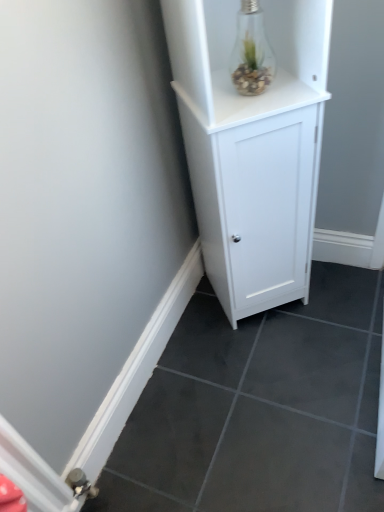
Measure the distance between transparent glass light bulb at upper right and camera.

transparent glass light bulb at upper right and camera are 39.04 inches apart.

What do you see at coordinates (251, 52) in the screenshot? The image size is (384, 512). I see `transparent glass light bulb at upper right` at bounding box center [251, 52].

In order to face transparent glass light bulb at upper right, should I rotate leftwards or rightwards?

To face it directly, rotate right by 8.611 degrees.

I want to click on transparent glass light bulb at upper right, so click(x=251, y=52).

What do you see at coordinates (252, 147) in the screenshot?
I see `white matte cabinet at center` at bounding box center [252, 147].

Locate an element on the screen. The width and height of the screenshot is (384, 512). white matte cabinet at center is located at coordinates (252, 147).

Find the location of a particular element. This screenshot has height=512, width=384. transparent glass light bulb at upper right is located at coordinates (251, 52).

Between white matte cabinet at center and transparent glass light bulb at upper right, which one appears on the right side from the viewer's perspective?

white matte cabinet at center is more to the right.

Considering the relative positions of white matte cabinet at center and transparent glass light bulb at upper right in the image provided, is white matte cabinet at center in front of transparent glass light bulb at upper right?

Yes, white matte cabinet at center is closer to the camera.

Is point (268, 133) positioned before point (259, 6)?

Yes, point (268, 133) is closer to viewer.

From the image's perspective, would you say white matte cabinet at center is positioned over transparent glass light bulb at upper right?

Actually, white matte cabinet at center appears below transparent glass light bulb at upper right in the image.

From a real-world perspective, which is physically above, white matte cabinet at center or transparent glass light bulb at upper right?

In real-world perspective, transparent glass light bulb at upper right is above.

Does white matte cabinet at center have a lesser width compared to transparent glass light bulb at upper right?

No.

Is white matte cabinet at center taller than transparent glass light bulb at upper right?

Correct, white matte cabinet at center is much taller as transparent glass light bulb at upper right.

Who is smaller, white matte cabinet at center or transparent glass light bulb at upper right?

With smaller size is transparent glass light bulb at upper right.

Is transparent glass light bulb at upper right inside white matte cabinet at center?

Indeed, transparent glass light bulb at upper right is located within white matte cabinet at center.

From the picture: Would you consider white matte cabinet at center to be distant from transparent glass light bulb at upper right?

No, there isn't a large distance between white matte cabinet at center and transparent glass light bulb at upper right.

Is transparent glass light bulb at upper right at the back of white matte cabinet at center?

Correct, white matte cabinet at center is looking away from transparent glass light bulb at upper right.

How many degrees apart are the facing directions of white matte cabinet at center and transparent glass light bulb at upper right?

They differ by 0.689 degrees in their facing directions.

You are a GUI agent. You are given a task and a screenshot of the screen. Output one action in this format:
    pyautogui.click(x=<x>, y=<y>)
    Task: Click on the glass vase located behind the white matte cabinet at center
    This screenshot has width=384, height=512.
    Given the screenshot: What is the action you would take?
    pyautogui.click(x=251, y=52)

Based on their positions, is transparent glass light bulb at upper right located to the left or right of white matte cabinet at center?

transparent glass light bulb at upper right is to the left of white matte cabinet at center.

Considering the relative positions of transparent glass light bulb at upper right and white matte cabinet at center in the image provided, is transparent glass light bulb at upper right in front of white matte cabinet at center?

No, the depth of transparent glass light bulb at upper right is greater than that of white matte cabinet at center.

Considering the positions of point (247, 54) and point (225, 289), is point (247, 54) closer or farther from the camera than point (225, 289)?

Point (247, 54).

From the image's perspective, is transparent glass light bulb at upper right under white matte cabinet at center?

Incorrect, from the image's perspective, transparent glass light bulb at upper right is higher than white matte cabinet at center.

From a real-world perspective, who is located higher, transparent glass light bulb at upper right or white matte cabinet at center?

transparent glass light bulb at upper right, from a real-world perspective.

Is transparent glass light bulb at upper right wider than white matte cabinet at center?

No, transparent glass light bulb at upper right is not wider than white matte cabinet at center.

Considering the sizes of objects transparent glass light bulb at upper right and white matte cabinet at center in the image provided, who is shorter, transparent glass light bulb at upper right or white matte cabinet at center?

transparent glass light bulb at upper right.

In the scene shown: Who is smaller, transparent glass light bulb at upper right or white matte cabinet at center?

Smaller between the two is transparent glass light bulb at upper right.

Is transparent glass light bulb at upper right spatially inside white matte cabinet at center, or outside of it?

transparent glass light bulb at upper right is contained in white matte cabinet at center.

Is transparent glass light bulb at upper right not near white matte cabinet at center?

They are positioned close to each other.

Is white matte cabinet at center at the back of transparent glass light bulb at upper right?

Correct, transparent glass light bulb at upper right is looking away from white matte cabinet at center.

What's the angular difference between transparent glass light bulb at upper right and white matte cabinet at center's facing directions?

0.689 degrees.

Where is `glass vase positioned vertically above the white matte cabinet at center (from a real-world perspective)`? glass vase positioned vertically above the white matte cabinet at center (from a real-world perspective) is located at coordinates (251, 52).

Where is `cupboard below the transparent glass light bulb at upper right (from the image's perspective)`? cupboard below the transparent glass light bulb at upper right (from the image's perspective) is located at coordinates (252, 147).

At what (x,y) coordinates should I click in order to perform the action: click on cupboard in front of the transparent glass light bulb at upper right. Please return your answer as a coordinate pair (x, y). The height and width of the screenshot is (512, 384). Looking at the image, I should click on (252, 147).